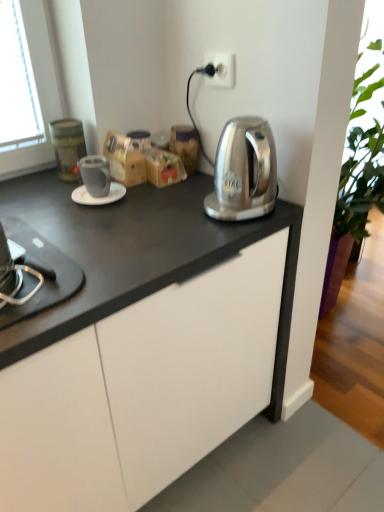
Question: Is white glossy saucer at center not inside white plastic electric outlet at upper center?

Choices:
 (A) yes
 (B) no

Answer: (A)

Question: Are white glossy saucer at center and white plastic electric outlet at upper center far apart?

Choices:
 (A) yes
 (B) no

Answer: (B)

Question: Does white glossy saucer at center come in front of white plastic electric outlet at upper center?

Choices:
 (A) yes
 (B) no

Answer: (B)

Question: Does white glossy saucer at center appear on the left side of white plastic electric outlet at upper center?

Choices:
 (A) no
 (B) yes

Answer: (B)

Question: Does white glossy saucer at center have a lesser height compared to white plastic electric outlet at upper center?

Choices:
 (A) yes
 (B) no

Answer: (A)

Question: Do you think white glossy saucer at center is within brown paper bag at center, which is the first cabinetry from top to bottom, or outside of it?

Choices:
 (A) outside
 (B) inside

Answer: (A)

Question: From a real-world perspective, is white glossy saucer at center physically located above or below brown paper bag at center, positioned as the 2th cabinetry in front-to-back order?

Choices:
 (A) below
 (B) above

Answer: (A)

Question: Is white glossy saucer at center taller or shorter than brown paper bag at center, positioned as the 2th cabinetry in front-to-back order?

Choices:
 (A) tall
 (B) short

Answer: (B)

Question: Relative to brown paper bag at center, the first cabinetry positioned from the right, is white glossy saucer at center in front or behind?

Choices:
 (A) front
 (B) behind

Answer: (A)

Question: From the image's perspective, is brown cardboard box at center above or below white glossy saucer at center?

Choices:
 (A) above
 (B) below

Answer: (A)

Question: Looking at their shapes, would you say brown cardboard box at center is wider or thinner than white glossy saucer at center?

Choices:
 (A) wide
 (B) thin

Answer: (A)

Question: Is brown cardboard box at center taller or shorter than white glossy saucer at center?

Choices:
 (A) tall
 (B) short

Answer: (A)

Question: Is brown cardboard box at center to the left or to the right of white glossy saucer at center in the image?

Choices:
 (A) right
 (B) left

Answer: (A)

Question: Considering the positions of point (92, 168) and point (119, 184), is point (92, 168) closer or farther from the camera than point (119, 184)?

Choices:
 (A) farther
 (B) closer

Answer: (B)

Question: Is matte gray mug at center-left bigger or smaller than white glossy saucer at center?

Choices:
 (A) big
 (B) small

Answer: (A)